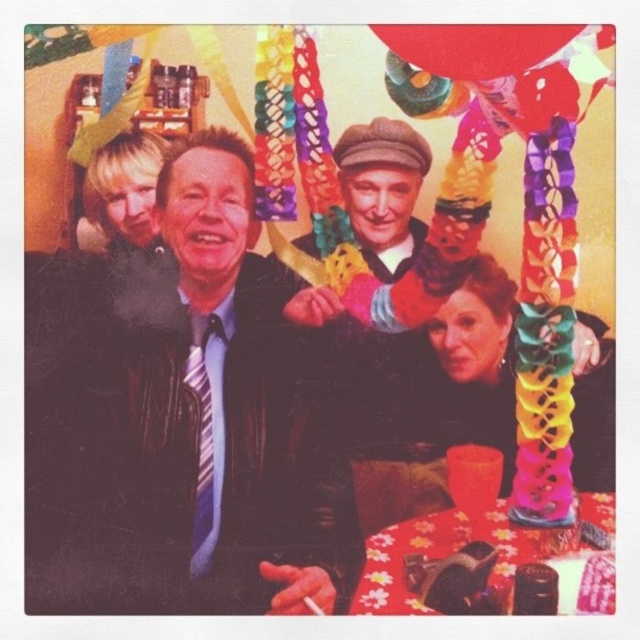
You are standing in the room and want to move from the point at coordinates point (211, 148) to the point at coordinates point (536, 54). Which direction should you move in to get closer to your destination?

To move from point (211, 148) to point (536, 54), you should move backward since point (211, 148) is closer to you than point (536, 54).